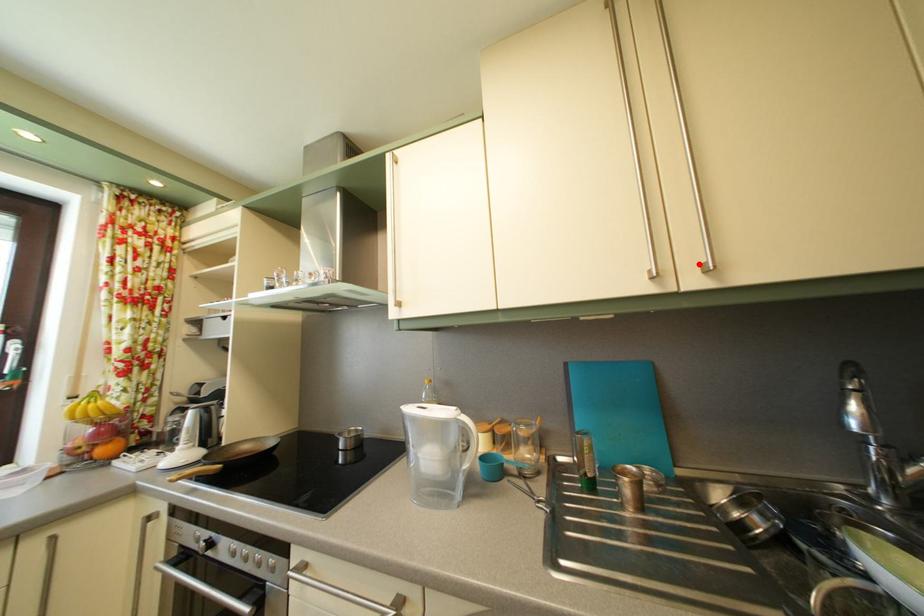
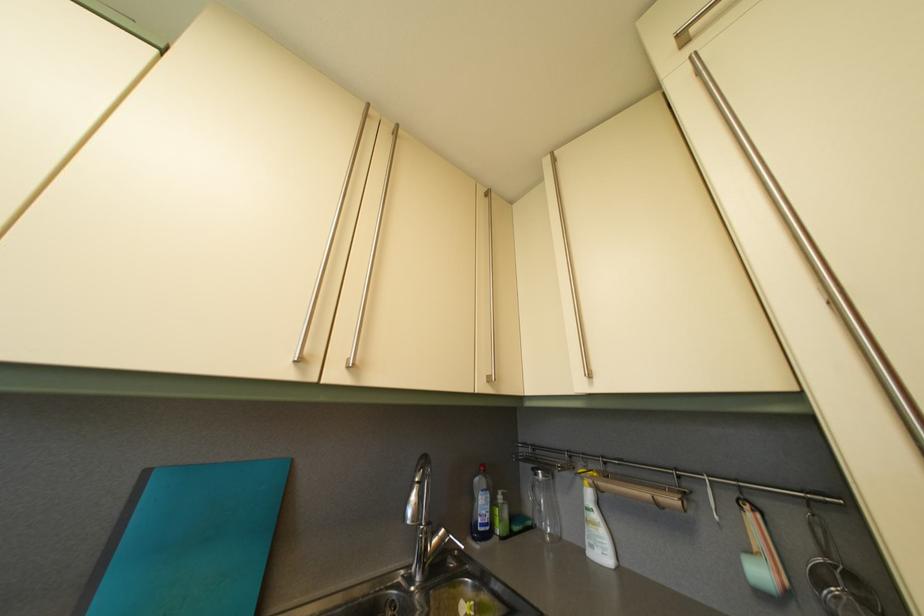
The point at the highlighted location is marked in the first image. Where is the corresponding point in the second image?

(350, 355)